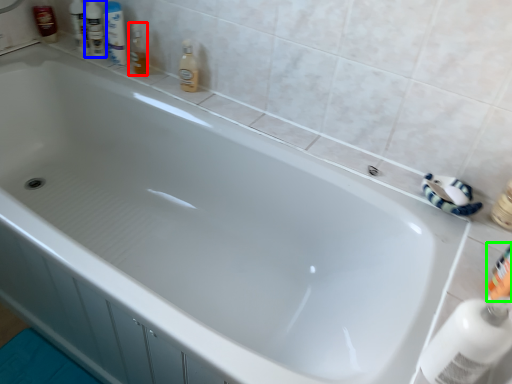
Question: Which is nearer to the toiletry (highlighted by a red box)? toiletry (highlighted by a blue box) or toiletry (highlighted by a green box).

Choices:
 (A) toiletry
 (B) toiletry

Answer: (A)